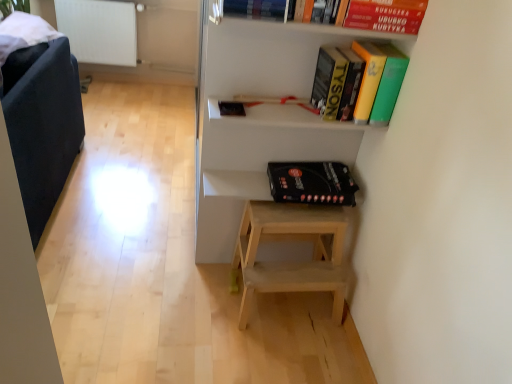
Find the location of a particular element. vacant area on top of yellow matte book at upper center, the 1th book when ordered from bottom to top (from a real-world perspective) is located at coordinates pyautogui.click(x=368, y=45).